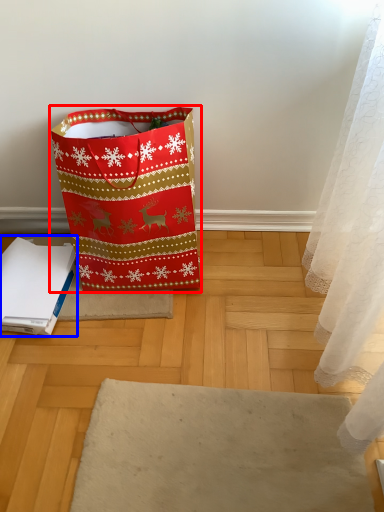
Question: Which object appears farthest to the camera in this image, luggage and bags (highlighted by a red box) or notebook (highlighted by a blue box)?

Choices:
 (A) luggage and bags
 (B) notebook

Answer: (B)